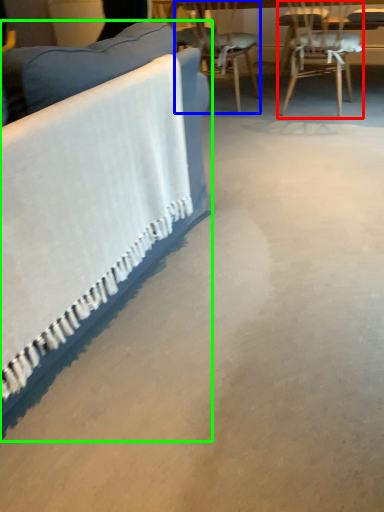
Question: Which object is the closest to the chair (highlighted by a red box)? Choose among these: chair (highlighted by a blue box) or studio couch (highlighted by a green box).

Choices:
 (A) chair
 (B) studio couch

Answer: (A)